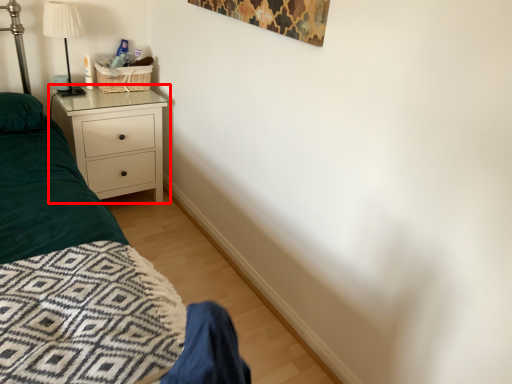
Question: From the image's perspective, where is chest of drawers (annotated by the red box) located relative to lamp?

Choices:
 (A) below
 (B) above

Answer: (A)